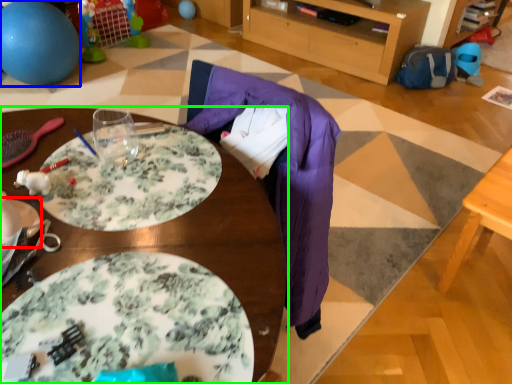
Question: Which is nearer to the plate (highlighted by a red box)? ball (highlighted by a blue box) or table (highlighted by a green box).

Choices:
 (A) ball
 (B) table

Answer: (B)